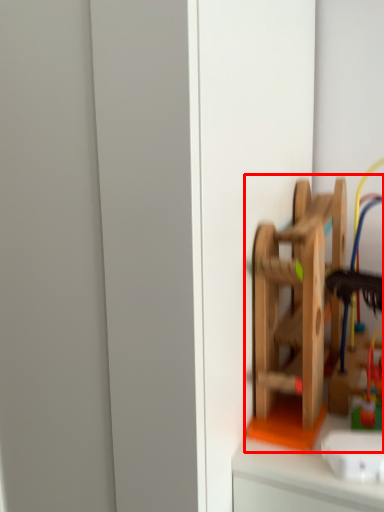
Question: From the image's perspective, considering the relative positions of toy (annotated by the red box) and toy in the image provided, where is toy (annotated by the red box) located with respect to the staircase?

Choices:
 (A) below
 (B) above

Answer: (B)